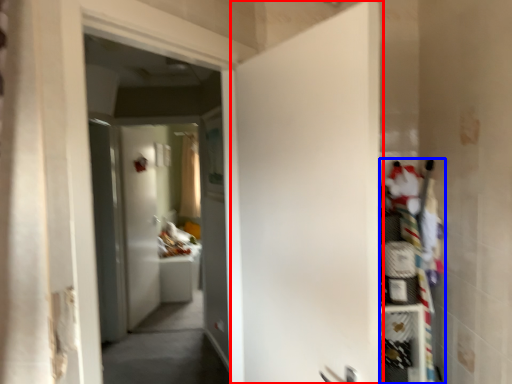
Question: Which of the following is the closest to the observer, door (highlighted by a red box) or shelf (highlighted by a blue box)?

Choices:
 (A) door
 (B) shelf

Answer: (A)